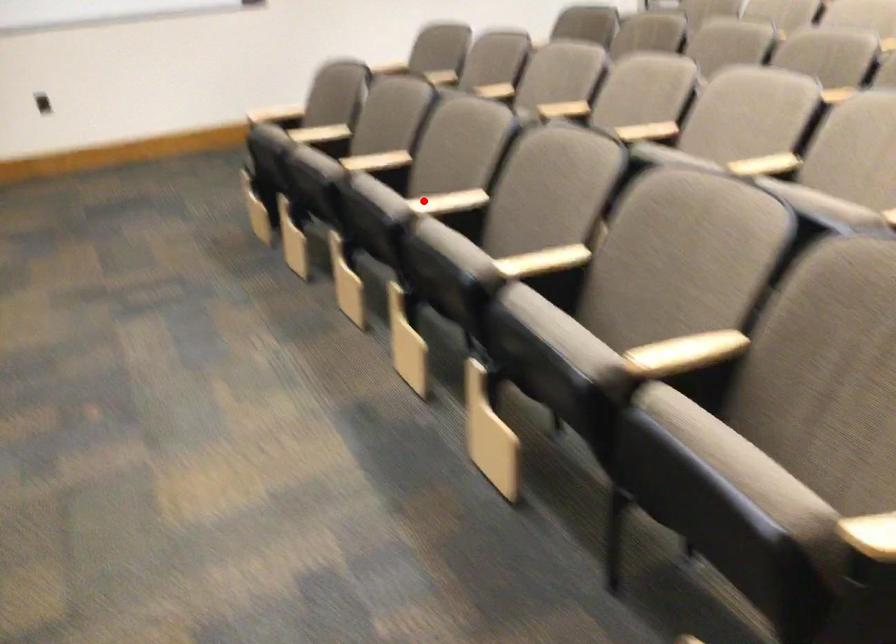
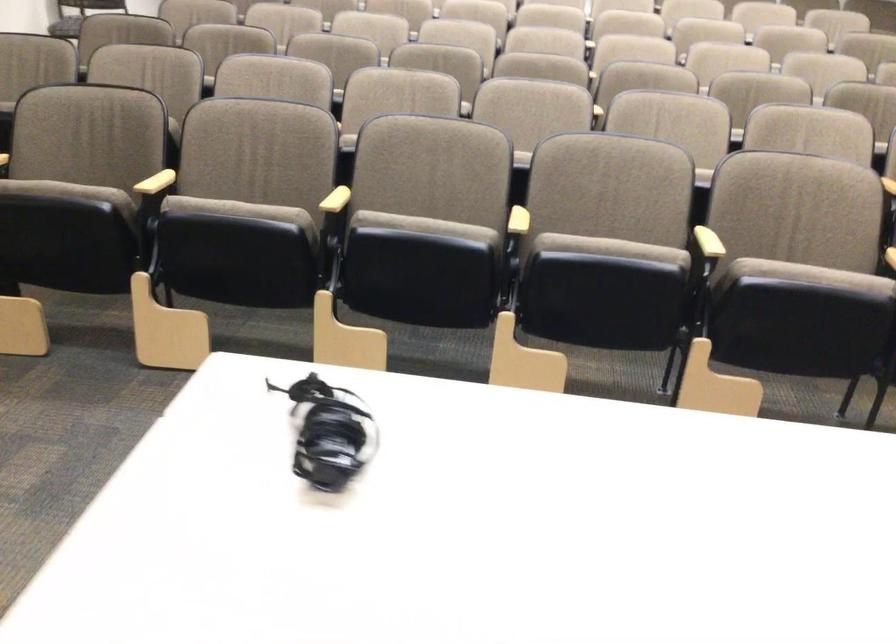
In the second image, find the point that corresponds to the highlighted location in the first image.

(518, 221)